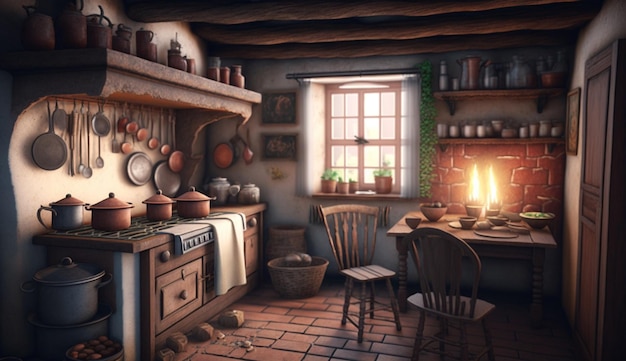
This screenshot has width=626, height=361. Identify the location of basket on floor. (304, 276).